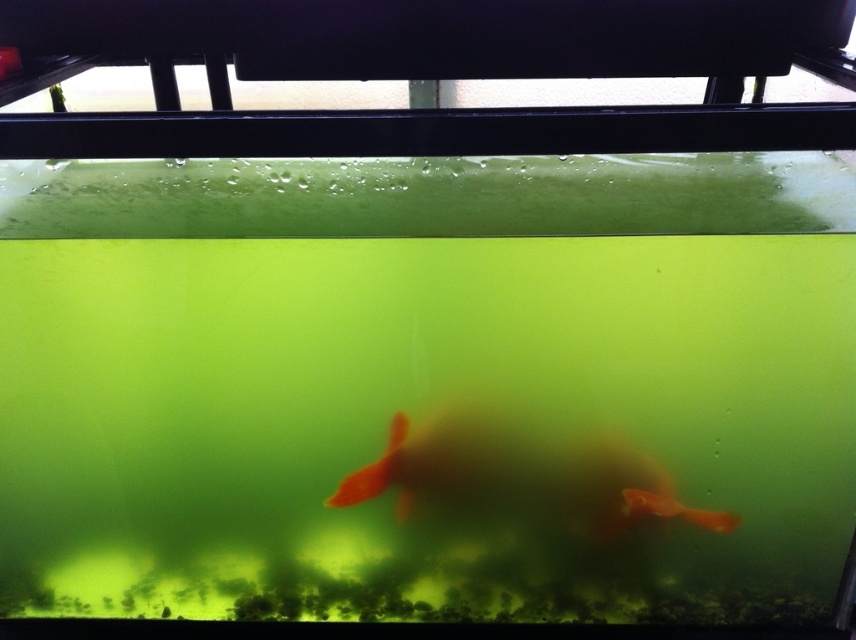
Question: Does translucent orange fish at center appear on the left side of orange matte goldfish at center?

Choices:
 (A) no
 (B) yes

Answer: (B)

Question: Is translucent orange fish at center below orange matte goldfish at center?

Choices:
 (A) yes
 (B) no

Answer: (B)

Question: Which object is farther from the camera taking this photo?

Choices:
 (A) translucent orange fish at center
 (B) orange matte goldfish at center

Answer: (B)

Question: Among these points, which one is farthest from the camera?

Choices:
 (A) (629, 497)
 (B) (577, 492)

Answer: (A)

Question: Can you confirm if translucent orange fish at center is bigger than orange matte goldfish at center?

Choices:
 (A) no
 (B) yes

Answer: (B)